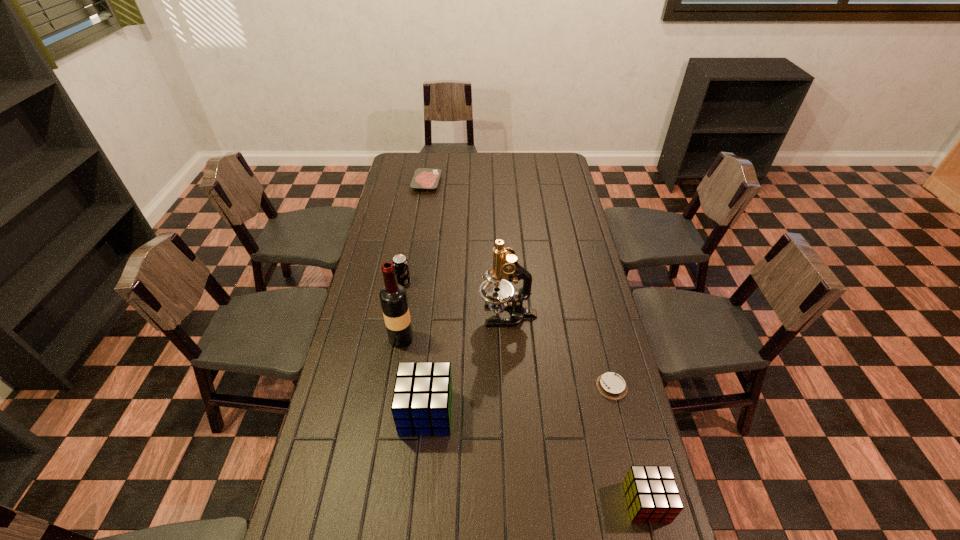
This screenshot has width=960, height=540. What are the coordinates of `vacant region at the far left corner` in the screenshot? It's located at (417, 163).

In the image, there is a desktop. Where is `vacant space at the far right corner`? vacant space at the far right corner is located at coordinates (553, 168).

Identify the location of free point between the chocolate cake and the nearest object. (629, 444).

Identify the location of free space between the microscope and the second farthest object. Image resolution: width=960 pixels, height=540 pixels. (455, 299).

Where is `vacant space that's between the microscope and the steak`? The image size is (960, 540). vacant space that's between the microscope and the steak is located at coordinates (467, 248).

Find the location of a particular element. unoccupied position between the soda can and the third tallest object is located at coordinates (415, 348).

You are a GUI agent. You are given a task and a screenshot of the screen. Output one action in this format:
    pyautogui.click(x=<x>, y=<y>)
    Task: Click on the free space between the steak and the farther cube
    
    Given the screenshot: What is the action you would take?
    pyautogui.click(x=426, y=298)

In order to click on vacant space that's between the chocolate cake and the nearest object in this screenshot , I will do `click(629, 444)`.

The height and width of the screenshot is (540, 960). In order to click on vacant area that lies between the fourth shortest object and the farthest object in this screenshot , I will do `click(415, 233)`.

Locate an element on the screen. The height and width of the screenshot is (540, 960). unoccupied area between the wine bottle and the microscope is located at coordinates (454, 327).